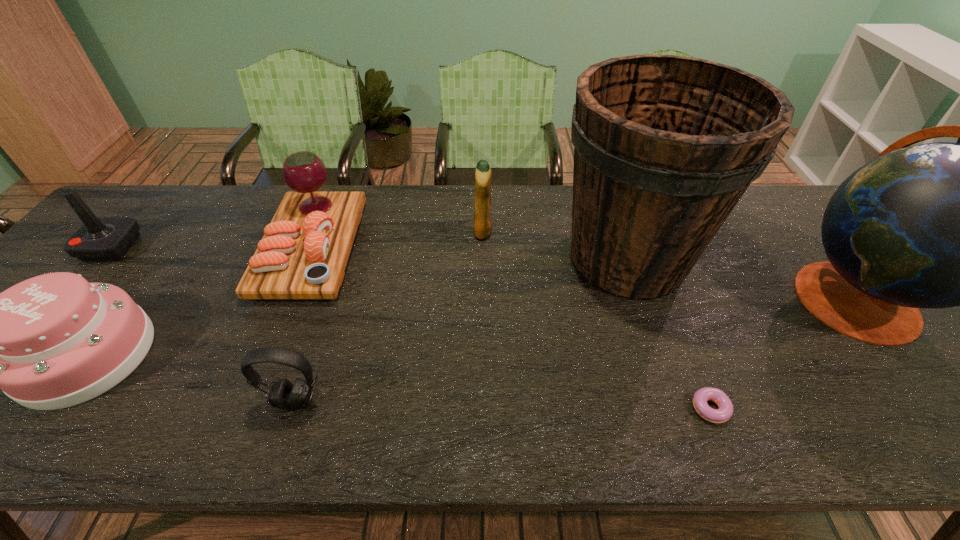
What are the coordinates of `object that is at the far left corner` in the screenshot? It's located at (99, 238).

Where is `free space at the far edge of the desktop`? free space at the far edge of the desktop is located at coordinates (391, 212).

This screenshot has height=540, width=960. What are the coordinates of `blank space at the near edge of the desktop` in the screenshot? It's located at (98, 416).

In the image, there is a desktop. Identify the location of vacant space at the left edge. (98, 278).

Find the location of a particular element. The width and height of the screenshot is (960, 540). free location at the right edge of the desktop is located at coordinates (958, 382).

Identify the location of empty space that is in between the doughnut and the fifth object from left to right. The image size is (960, 540). (597, 321).

Identify the location of vacant space that's between the bucket and the headset. The height and width of the screenshot is (540, 960). (461, 329).

Where is `free space between the shortest object and the joystick`? The width and height of the screenshot is (960, 540). free space between the shortest object and the joystick is located at coordinates (411, 329).

Choose which object is the nearest neighbor to the platter. Please provide its 2D coordinates. Your answer should be formatted as a tuple, i.e. [(x, y)], where the tuple contains the x and y coordinates of a point satisfying the conditions above.

[(53, 341)]

What are the coordinates of `object identified as the fifth closest to the bucket` in the screenshot? It's located at (303, 254).